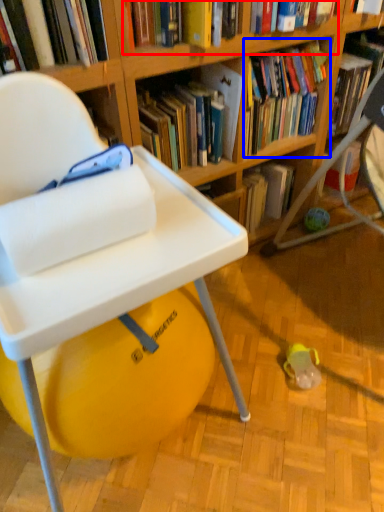
Question: Which object is closer to the camera taking this photo, book (highlighted by a red box) or book (highlighted by a blue box)?

Choices:
 (A) book
 (B) book

Answer: (A)